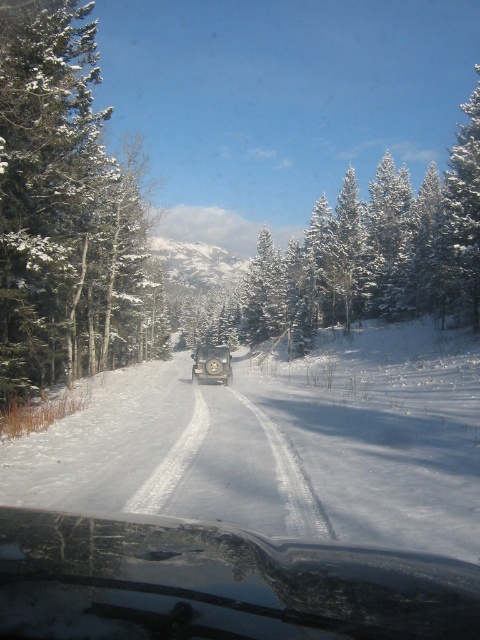
Question: Does white powdery snow at center appear on the right side of satin silver car at center?

Choices:
 (A) yes
 (B) no

Answer: (A)

Question: Which of the following is the closest to the observer?

Choices:
 (A) (104, 314)
 (B) (210, 348)
 (C) (312, 365)

Answer: (B)

Question: Which of the following is the closest to the observer?

Choices:
 (A) transparent glass windshield at center
 (B) white powdery snow at center
 (C) snow-covered evergreen tree at left
 (D) satin silver car at center

Answer: (A)

Question: Is the position of white powdery snow at center more distant than that of transparent glass windshield at center?

Choices:
 (A) yes
 (B) no

Answer: (A)

Question: Which of the following is the closest to the observer?

Choices:
 (A) snow-covered evergreen tree at left
 (B) white powdery snow at center
 (C) satin silver car at center

Answer: (B)

Question: Can you confirm if white powdery snow at center is positioned to the right of transparent glass windshield at center?

Choices:
 (A) no
 (B) yes

Answer: (B)